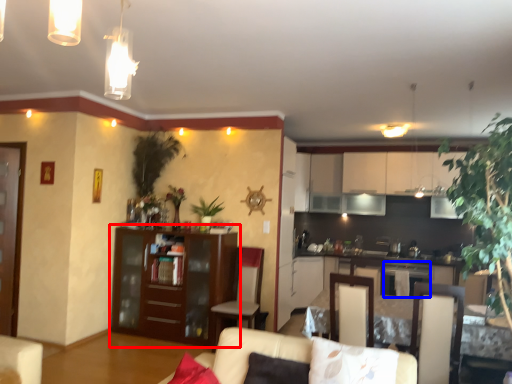
Question: Which object appears closest to the camera in this image, cabinetry (highlighted by a red box) or appliance (highlighted by a blue box)?

Choices:
 (A) cabinetry
 (B) appliance

Answer: (A)